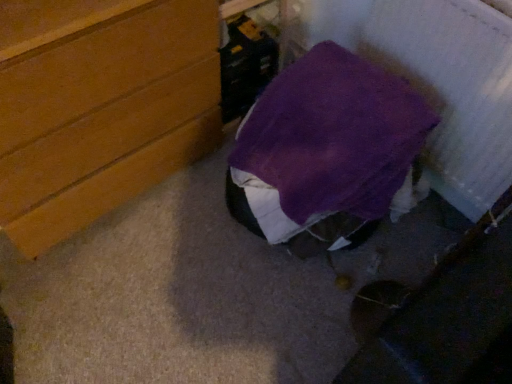
Describe the element at coordinates (106, 119) in the screenshot. I see `wooden chest of drawers at left` at that location.

Find the location of a particular element. wooden chest of drawers at left is located at coordinates (106, 119).

What do you see at coordinates (327, 153) in the screenshot? I see `purple fabric bag at center` at bounding box center [327, 153].

Image resolution: width=512 pixels, height=384 pixels. I want to click on purple fabric bag at center, so click(327, 153).

I want to click on wooden chest of drawers at left, so click(106, 119).

Which is more to the left, purple fabric bag at center or wooden chest of drawers at left?

wooden chest of drawers at left.

Which object is closer to the camera, purple fabric bag at center or wooden chest of drawers at left?

wooden chest of drawers at left is closer to the camera.

Which is in front, point (365, 88) or point (159, 88)?

The point (365, 88) is closer to the camera.

From the image's perspective, which is below, purple fabric bag at center or wooden chest of drawers at left?

purple fabric bag at center appears lower in the image.

From a real-world perspective, is purple fabric bag at center above or below wooden chest of drawers at left?

In terms of real-world spatial position, purple fabric bag at center is below wooden chest of drawers at left.

Considering the sizes of objects purple fabric bag at center and wooden chest of drawers at left in the image provided, who is wider, purple fabric bag at center or wooden chest of drawers at left?

Wider between the two is purple fabric bag at center.

In terms of height, does purple fabric bag at center look taller or shorter compared to wooden chest of drawers at left?

purple fabric bag at center is shorter than wooden chest of drawers at left.

Is purple fabric bag at center bigger than wooden chest of drawers at left?

No, purple fabric bag at center is not bigger than wooden chest of drawers at left.

Is purple fabric bag at center located outside wooden chest of drawers at left?

Yes.

From the picture: Is purple fabric bag at center in contact with wooden chest of drawers at left?

purple fabric bag at center and wooden chest of drawers at left are clearly separated.

Is purple fabric bag at center oriented away from wooden chest of drawers at left?

No, purple fabric bag at center is not facing the opposite direction of wooden chest of drawers at left.

What are the coordinates of `the chest of drawers located above the purple fabric bag at center (from a real-world perspective)` in the screenshot? It's located at (106, 119).

Considering the relative positions of wooden chest of drawers at left and purple fabric bag at center in the image provided, is wooden chest of drawers at left to the left of purple fabric bag at center from the viewer's perspective?

Indeed, wooden chest of drawers at left is positioned on the left side of purple fabric bag at center.

Between wooden chest of drawers at left and purple fabric bag at center, which one is positioned in front?

wooden chest of drawers at left is in front.

Is point (96, 91) behind point (289, 102)?

No, (96, 91) is in front of (289, 102).

From the image's perspective, who appears lower, wooden chest of drawers at left or purple fabric bag at center?

purple fabric bag at center is shown below in the image.

From a real-world perspective, is wooden chest of drawers at left on top of purple fabric bag at center?

Indeed, from a real-world perspective, wooden chest of drawers at left stands above purple fabric bag at center.

Consider the image. Which object is wider, wooden chest of drawers at left or purple fabric bag at center?

With larger width is purple fabric bag at center.

Is wooden chest of drawers at left shorter than purple fabric bag at center?

No.

Considering the sizes of objects wooden chest of drawers at left and purple fabric bag at center in the image provided, who is smaller, wooden chest of drawers at left or purple fabric bag at center?

With smaller size is purple fabric bag at center.

Which is correct: wooden chest of drawers at left is inside purple fabric bag at center, or outside of it?

wooden chest of drawers at left lies outside purple fabric bag at center.

Is the surface of wooden chest of drawers at left in direct contact with purple fabric bag at center?

No, wooden chest of drawers at left is not touching purple fabric bag at center.

Could you tell me if wooden chest of drawers at left is facing purple fabric bag at center?

Yes, wooden chest of drawers at left is facing purple fabric bag at center.

Can you tell me how much wooden chest of drawers at left and purple fabric bag at center differ in facing direction?

The facing directions of wooden chest of drawers at left and purple fabric bag at center are 92 degrees apart.

How distant is wooden chest of drawers at left from purple fabric bag at center?

The distance of wooden chest of drawers at left from purple fabric bag at center is 18.44 inches.

At what (x,y) coordinates should I click in order to perform the action: click on the chest of drawers in front of the purple fabric bag at center. Please return your answer as a coordinate pair (x, y). Image resolution: width=512 pixels, height=384 pixels. Looking at the image, I should click on (106, 119).

Locate an element on the screen. This screenshot has width=512, height=384. chest of drawers that appears on the left of purple fabric bag at center is located at coordinates (106, 119).

This screenshot has height=384, width=512. In the image, there is a wooden chest of drawers at left. What are the coordinates of `furniture below it (from the image's perspective)` in the screenshot? It's located at (327, 153).